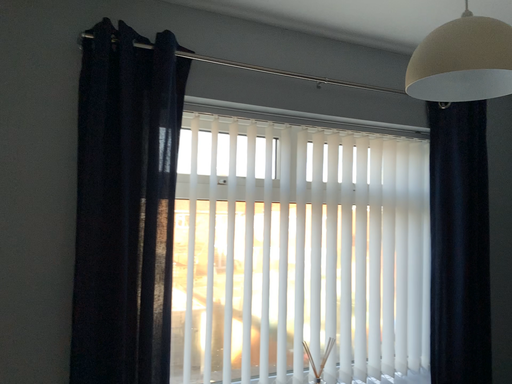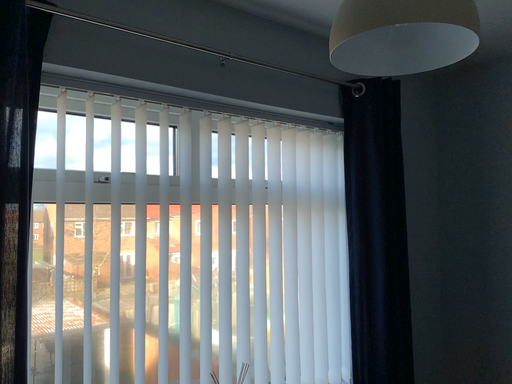
Question: How did the camera likely rotate when shooting the video?

Choices:
 (A) rotated right
 (B) rotated left

Answer: (A)